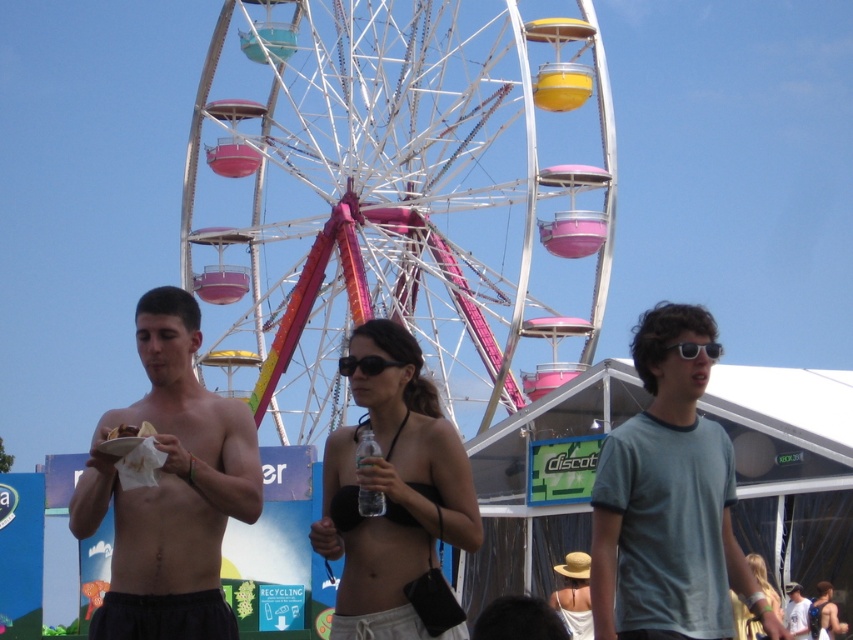
You are at a fair and want to store both the clear plastic bottle at center and the black plastic sunglasses at center in your bag. Which item will take up less space horizontally?

The clear plastic bottle at center has a lesser width compared to black plastic sunglasses at center, so it will take up less horizontal space.

You are a photographer at the fair and want to capture a photo of the clear plastic bottle at center and the black plastic sunglasses at center. Which object should you focus on first if you want to ensure both are in focus without moving the camera?

The clear plastic bottle at center is below the black plastic sunglasses at center, so focusing on the black plastic sunglasses at center first will ensure both are in focus since it is closer to the camera.

You are a photographer taking a picture of the clear plastic bottle at center and the black plastic sunglasses at center. Which object will appear closer to the camera in the photo?

The clear plastic bottle at center will appear closer to the camera in the photo because it is positioned in front of the black plastic sunglasses at center.